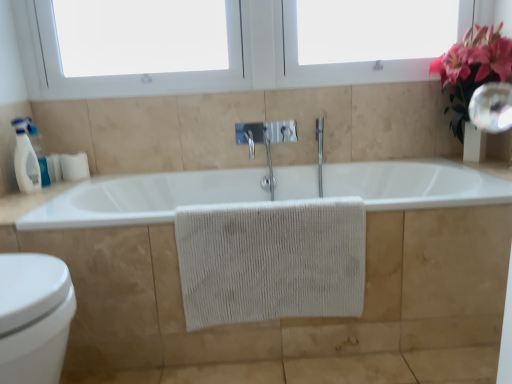
Question: Is white glossy bidet at lower left a part of white matte bathtub at center?

Choices:
 (A) yes
 (B) no

Answer: (B)

Question: From the image's perspective, is white matte bathtub at center above white glossy bidet at lower left?

Choices:
 (A) yes
 (B) no

Answer: (A)

Question: Does white matte bathtub at center turn towards white glossy bidet at lower left?

Choices:
 (A) yes
 (B) no

Answer: (A)

Question: Is white matte bathtub at center behind white glossy bidet at lower left?

Choices:
 (A) yes
 (B) no

Answer: (A)

Question: Considering the relative positions of white matte bathtub at center and white glossy bidet at lower left in the image provided, is white matte bathtub at center to the left of white glossy bidet at lower left from the viewer's perspective?

Choices:
 (A) yes
 (B) no

Answer: (B)

Question: From the image's perspective, relative to white plastic window screen at upper right, which is counted as the second window screen, starting from the left, is pink silk flowers at upper right above or below?

Choices:
 (A) above
 (B) below

Answer: (B)

Question: In terms of size, does pink silk flowers at upper right appear bigger or smaller than white plastic window screen at upper right, which is counted as the second window screen, starting from the left?

Choices:
 (A) big
 (B) small

Answer: (B)

Question: Relative to white plastic window screen at upper right, which is counted as the second window screen, starting from the left, is pink silk flowers at upper right in front or behind?

Choices:
 (A) front
 (B) behind

Answer: (A)

Question: Is pink silk flowers at upper right situated inside white plastic window screen at upper right, which appears as the first window screen when viewed from the right, or outside?

Choices:
 (A) outside
 (B) inside

Answer: (A)

Question: From a real-world perspective, relative to beige textured towel at center, is white glossy bidet at lower left vertically above or below?

Choices:
 (A) below
 (B) above

Answer: (A)

Question: Considering the positions of point (32, 344) and point (192, 288), is point (32, 344) closer or farther from the camera than point (192, 288)?

Choices:
 (A) closer
 (B) farther

Answer: (A)

Question: Would you say white glossy bidet at lower left is to the left or to the right of beige textured towel at center in the picture?

Choices:
 (A) right
 (B) left

Answer: (B)

Question: Is white glossy bidet at lower left taller or shorter than beige textured towel at center?

Choices:
 (A) tall
 (B) short

Answer: (A)

Question: From their relative heights in the image, would you say white glossy bottle at left is taller or shorter than white matte toilet paper at left?

Choices:
 (A) short
 (B) tall

Answer: (B)

Question: Does point (28, 173) appear closer or farther from the camera than point (74, 168)?

Choices:
 (A) closer
 (B) farther

Answer: (A)